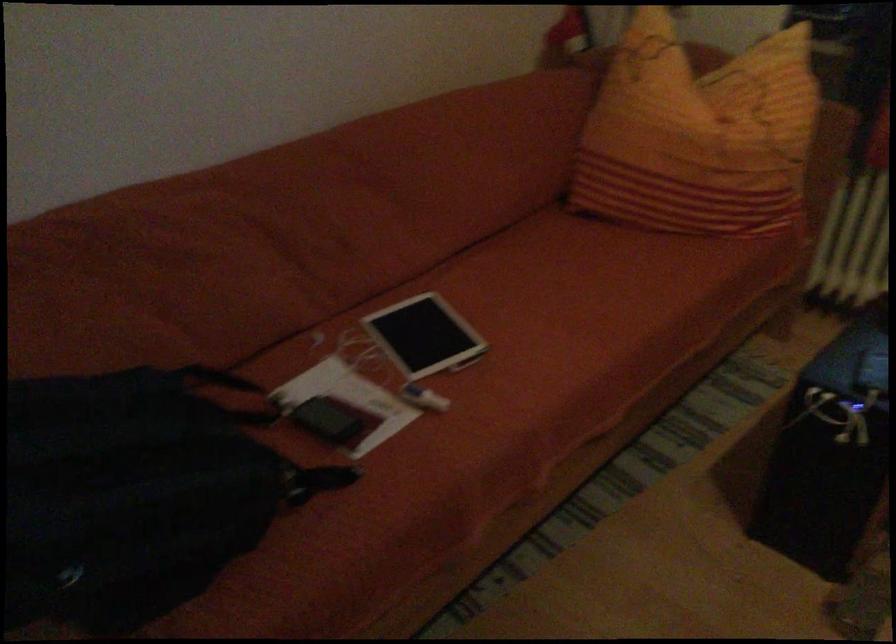
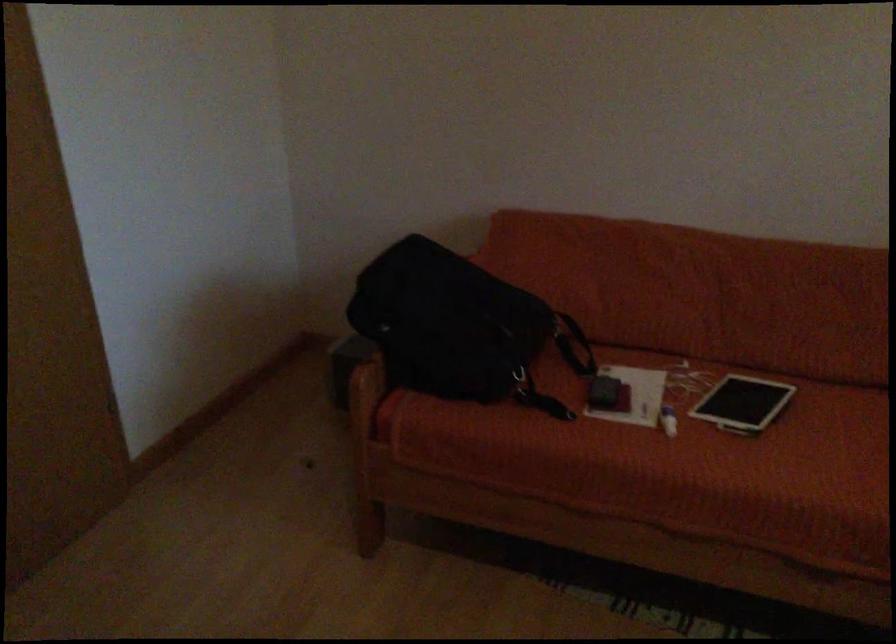
Find the pixel in the second image that matches point 177,480 in the first image.

(460, 328)